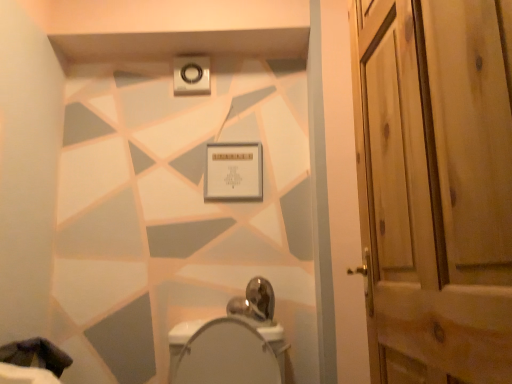
Question: Does dark fabric at lower left come in front of wooden door at right?

Choices:
 (A) yes
 (B) no

Answer: (B)

Question: Is wooden door at right inside dark fabric at lower left?

Choices:
 (A) no
 (B) yes

Answer: (A)

Question: Is dark fabric at lower left aimed at wooden door at right?

Choices:
 (A) no
 (B) yes

Answer: (A)

Question: From a real-world perspective, is dark fabric at lower left located beneath wooden door at right?

Choices:
 (A) no
 (B) yes

Answer: (B)

Question: Is dark fabric at lower left taller than wooden door at right?

Choices:
 (A) no
 (B) yes

Answer: (A)

Question: Can you confirm if dark fabric at lower left is positioned to the left of wooden door at right?

Choices:
 (A) no
 (B) yes

Answer: (B)

Question: From a real-world perspective, is wooden door at right below dark fabric at lower left?

Choices:
 (A) yes
 (B) no

Answer: (B)

Question: Considering the relative sizes of wooden door at right and dark fabric at lower left in the image provided, is wooden door at right shorter than dark fabric at lower left?

Choices:
 (A) yes
 (B) no

Answer: (B)

Question: Is wooden door at right in contact with dark fabric at lower left?

Choices:
 (A) no
 (B) yes

Answer: (A)

Question: Can you confirm if wooden door at right is wider than dark fabric at lower left?

Choices:
 (A) yes
 (B) no

Answer: (B)

Question: Is wooden door at right looking in the opposite direction of dark fabric at lower left?

Choices:
 (A) yes
 (B) no

Answer: (B)

Question: Can you confirm if wooden door at right is taller than dark fabric at lower left?

Choices:
 (A) no
 (B) yes

Answer: (B)

Question: Does white glossy bidet at center have a lesser width compared to wooden door at right?

Choices:
 (A) yes
 (B) no

Answer: (B)